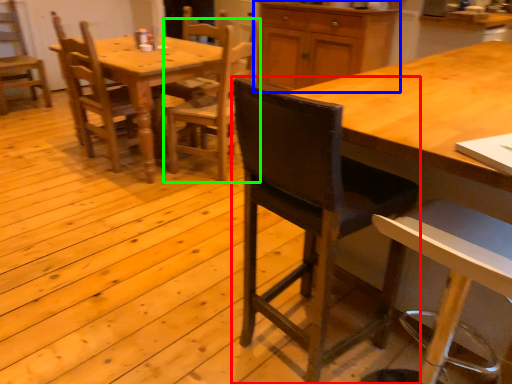
Question: Which object is the farthest from chair (highlighted by a red box)? Choose among these: cabinetry (highlighted by a blue box) or chair (highlighted by a green box).

Choices:
 (A) cabinetry
 (B) chair

Answer: (A)